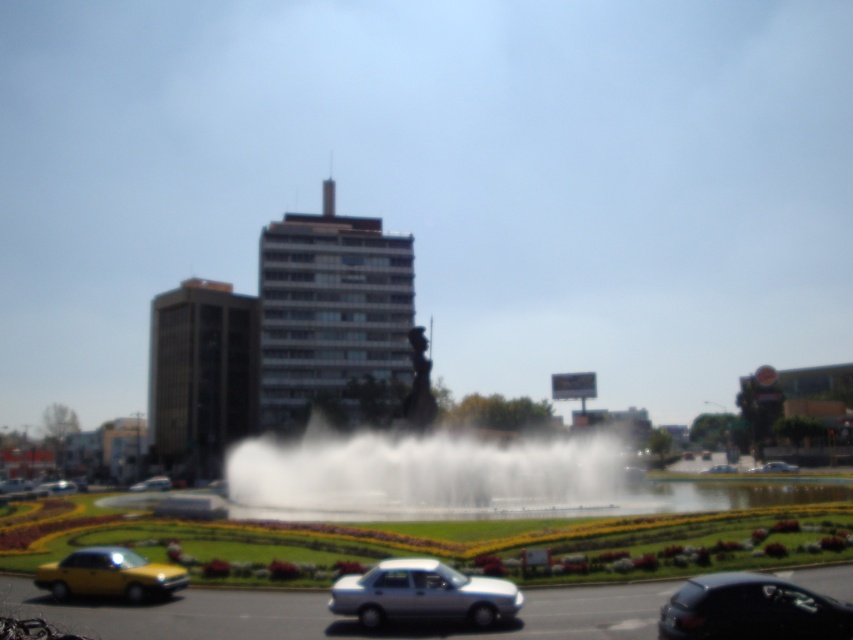
Is yellow matte taxi at lower left positioned in front of yellow matte car at lower left?

Yes, it is.

Between point (97, 577) and point (39, 486), which one is positioned in front?

Point (97, 577) is in front.

Is point (86, 584) behind point (35, 490)?

No, it is not.

Image resolution: width=853 pixels, height=640 pixels. Find the location of `yellow matte taxi at lower left`. yellow matte taxi at lower left is located at coordinates 109,573.

Can you confirm if yellow matte car at lower left is bigger than yellow matte car at center?

Yes.

Does yellow matte car at lower left lie in front of yellow matte car at center?

Yes, yellow matte car at lower left is closer to the viewer.

What do you see at coordinates (56, 486) in the screenshot? I see `yellow matte car at lower left` at bounding box center [56, 486].

Where is `yellow matte car at lower left`? yellow matte car at lower left is located at coordinates (56, 486).

Does white mist at center have a lesser height compared to silver metallic sedan at lower center?

No.

Is white mist at center smaller than silver metallic sedan at lower center?

Incorrect, white mist at center is not smaller in size than silver metallic sedan at lower center.

Does point (503, 472) come behind point (392, 568)?

That is True.

Find the location of a particular element. white mist at center is located at coordinates (425, 476).